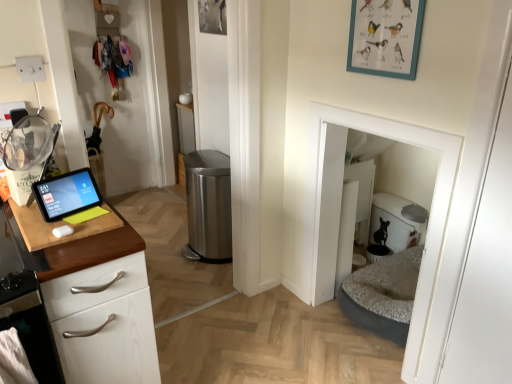
This screenshot has width=512, height=384. Find the location of `black glossy tablet at left`. black glossy tablet at left is located at coordinates (67, 194).

Describe the element at coordinates (67, 194) in the screenshot. I see `black glossy tablet at left` at that location.

In order to face teal matte picture frame at upper center, should I rotate leftwards or rightwards?

It's best to rotate right around 16.449 degrees.

The width and height of the screenshot is (512, 384). Describe the element at coordinates (385, 37) in the screenshot. I see `teal matte picture frame at upper center` at that location.

Where is `white matte door at center`? white matte door at center is located at coordinates (487, 271).

Is black glossy tablet at left facing away from white matte door at center?

No, black glossy tablet at left is not facing away from white matte door at center.

How different are the orientations of black glossy tablet at left and white matte door at center in degrees?

The angle between the facing direction of black glossy tablet at left and the facing direction of white matte door at center is 102 degrees.

At what (x,y) coordinates should I click in order to perform the action: click on tablet computer behind the white matte door at center. Please return your answer as a coordinate pair (x, y). This screenshot has width=512, height=384. Looking at the image, I should click on (67, 194).

Does black glossy tablet at left come behind white matte door at center?

Yes, it is behind white matte door at center.

Is wooden cutting board at left at the back of white matte door at center?

white matte door at center is not turned away from wooden cutting board at left.

Which is closer to the camera, (492,204) or (83,186)?

Point (492,204) is positioned closer to the camera compared to point (83,186).

Which is more to the left, white matte door at center or wooden cutting board at left?

From the viewer's perspective, wooden cutting board at left appears more on the left side.

Looking at this image, are white matte door at center and wooden cutting board at left located far from each other?

That's right, there is a large distance between white matte door at center and wooden cutting board at left.

Where is `appliance located above the light wood/white cabinetry at left (from the image's perspective)`? The image size is (512, 384). appliance located above the light wood/white cabinetry at left (from the image's perspective) is located at coordinates (208, 206).

From a real-world perspective, is light wood/white cabinetry at left physically below polished stainless steel trash can at center?

No.

Is light wood/white cabinetry at left bigger or smaller than polished stainless steel trash can at center?

In the image, light wood/white cabinetry at left appears to be larger than polished stainless steel trash can at center.

From the image's perspective, which one is positioned lower, light wood/white cabinetry at left or black glossy tablet at left?

light wood/white cabinetry at left.

The height and width of the screenshot is (384, 512). I want to click on cabinetry that appears on the right of black glossy tablet at left, so click(101, 308).

Between light wood/white cabinetry at left and black glossy tablet at left, which one has less height?

black glossy tablet at left.

Based on the photo, considering the sizes of objects light wood/white cabinetry at left and black glossy tablet at left in the image provided, who is thinner, light wood/white cabinetry at left or black glossy tablet at left?

With smaller width is black glossy tablet at left.

Locate an element on the screen. picture frame located above the white matte door at center (from a real-world perspective) is located at coordinates (385, 37).

Is teal matte picture frame at upper center positioned far away from white matte door at center?

Actually, teal matte picture frame at upper center and white matte door at center are a little close together.

Is white matte door at center inside teal matte picture frame at upper center?

Definitely not — white matte door at center is not inside teal matte picture frame at upper center.

From the image's perspective, is teal matte picture frame at upper center above or below white matte door at center?

teal matte picture frame at upper center is situated higher than white matte door at center in the image.

Is teal matte picture frame at upper center behind black glossy tablet at left?

Yes, it is.

Can you confirm if teal matte picture frame at upper center is smaller than black glossy tablet at left?

No.

Does point (415, 34) lie behind point (51, 210)?

Yes, it is behind point (51, 210).

From the image's perspective, is teal matte picture frame at upper center above or below black glossy tablet at left?

teal matte picture frame at upper center is situated higher than black glossy tablet at left in the image.

Is the position of white matte door at center less distant than that of black glossy tablet at left?

Yes.

Is point (506, 163) farther from camera compared to point (94, 196)?

No, (506, 163) is in front of (94, 196).

How different are the orientations of white matte door at center and black glossy tablet at left in degrees?

The facing directions of white matte door at center and black glossy tablet at left are 102 degrees apart.

Who is bigger, white matte door at center or black glossy tablet at left?

Bigger between the two is white matte door at center.

This screenshot has width=512, height=384. I want to click on tablet computer on the left side of white matte door at center, so click(x=67, y=194).

This screenshot has width=512, height=384. Identify the location of door directly beneath the wooden cutting board at left (from a real-world perspective). (487, 271).

Estimate the real-world distances between objects in this image. Which object is closer to light wood/white cabinetry at left, black glossy tablet at left or white matte door at center?

Based on the image, black glossy tablet at left appears to be nearer to light wood/white cabinetry at left.

Which object lies further to the anchor point teal matte picture frame at upper center, light wood/white cabinetry at left or polished stainless steel trash can at center?

polished stainless steel trash can at center is positioned further to the anchor teal matte picture frame at upper center.

From the image, which object appears to be nearer to white matte door at center, light wood/white cabinetry at left or teal matte picture frame at upper center?

teal matte picture frame at upper center lies closer to white matte door at center than the other object.

Estimate the real-world distances between objects in this image. Which object is closer to polished stainless steel trash can at center, white matte door at center or wooden cutting board at left?

Among the two, wooden cutting board at left is located nearer to polished stainless steel trash can at center.

From the image, which object appears to be farther from black glossy tablet at left, light wood/white cabinetry at left or wooden cutting board at left?

light wood/white cabinetry at left is positioned further to the anchor black glossy tablet at left.

Estimate the real-world distances between objects in this image. Which object is closer to white matte door at center, wooden cutting board at left or polished stainless steel trash can at center?

wooden cutting board at left is closer to white matte door at center.

Looking at this image, based on their spatial positions, is wooden cutting board at left or black glossy tablet at left closer to polished stainless steel trash can at center?

black glossy tablet at left lies closer to polished stainless steel trash can at center than the other object.

In the scene shown: From the image, which object appears to be farther from polished stainless steel trash can at center, black glossy tablet at left or teal matte picture frame at upper center?

teal matte picture frame at upper center lies further to polished stainless steel trash can at center than the other object.

The height and width of the screenshot is (384, 512). In order to click on cabinetry between wooden cutting board at left and white matte door at center in the horizontal direction in this screenshot , I will do [101, 308].

Locate an element on the screen. The image size is (512, 384). picture frame positioned between black glossy tablet at left and polished stainless steel trash can at center from near to far is located at coordinates (385, 37).

I want to click on sink between light wood/white cabinetry at left and polished stainless steel trash can at center along the z-axis, so click(62, 210).

Where is `appliance between black glossy tablet at left and white matte door at center in the horizontal direction`? Image resolution: width=512 pixels, height=384 pixels. appliance between black glossy tablet at left and white matte door at center in the horizontal direction is located at coordinates (208, 206).